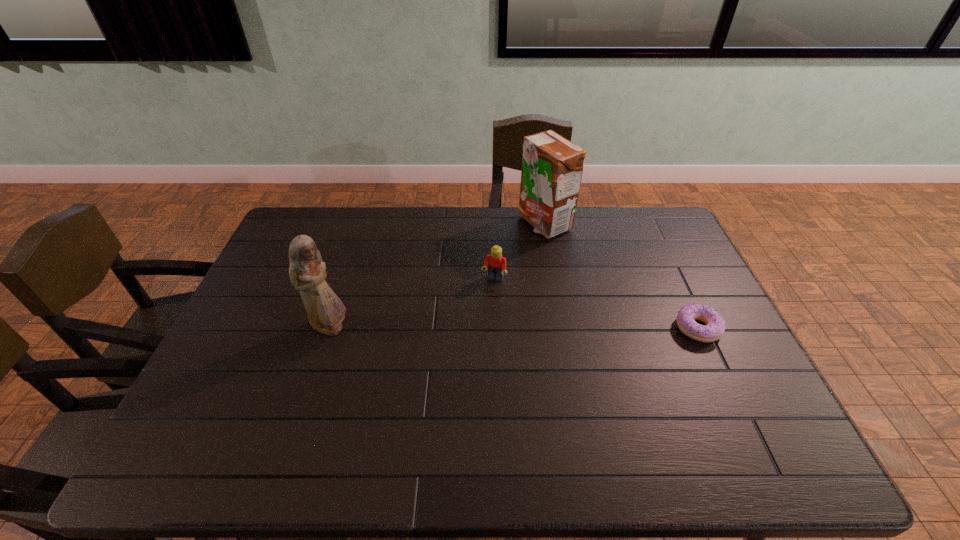
The height and width of the screenshot is (540, 960). In order to click on vacant space located 0.210m on the straw side of the second object from right to left in this screenshot , I will do `click(525, 280)`.

You are a GUI agent. You are given a task and a screenshot of the screen. Output one action in this format:
    pyautogui.click(x=<x>, y=<y>)
    Task: Click on the vacant region located on the straw side of the second object from right to left
    Image resolution: width=960 pixels, height=540 pixels.
    Given the screenshot: What is the action you would take?
    pyautogui.click(x=535, y=253)

This screenshot has height=540, width=960. Identify the location of free space located on the face of the Lego. tap(468, 340).

Where is `vacant space located 0.220m on the face of the Lego`? The image size is (960, 540). vacant space located 0.220m on the face of the Lego is located at coordinates (468, 338).

In order to click on vacant space located 0.330m on the face of the Lego in this screenshot , I will do `click(455, 368)`.

What are the coordinates of `object present at the far edge` in the screenshot? It's located at (552, 166).

This screenshot has height=540, width=960. I want to click on object present at the right edge, so click(715, 325).

The image size is (960, 540). In the image, there is a desktop. In order to click on vacant region at the far edge in this screenshot , I will do `click(494, 245)`.

In the image, there is a desktop. Where is `vacant space at the left edge`? The image size is (960, 540). vacant space at the left edge is located at coordinates (235, 365).

You are a GUI agent. You are given a task and a screenshot of the screen. Output one action in this format:
    pyautogui.click(x=<x>, y=<y>)
    Task: Click on the vacant space at the right edge of the desktop
    Image resolution: width=960 pixels, height=540 pixels.
    Given the screenshot: What is the action you would take?
    pyautogui.click(x=705, y=373)